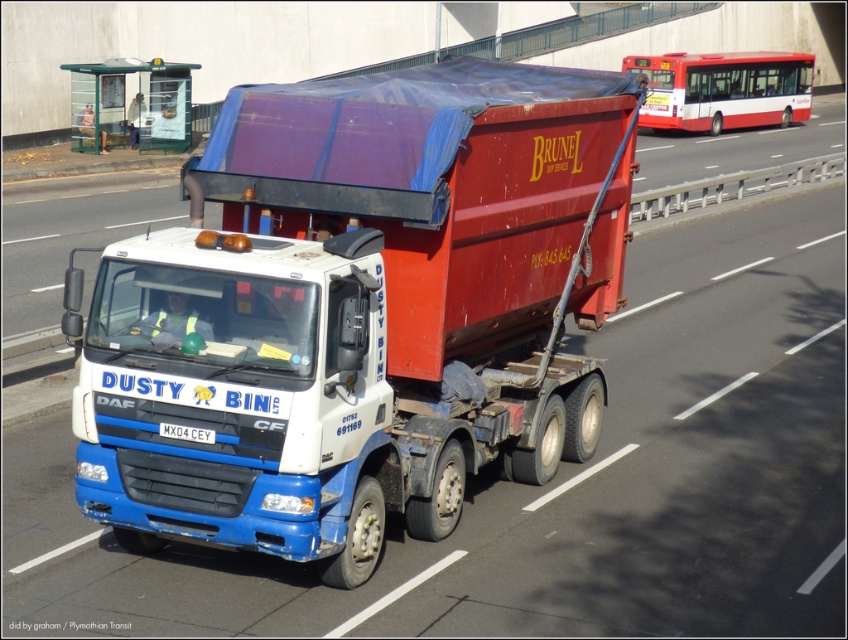
Question: In this image, where is matte white truck at center located relative to white plastic license plate at center?

Choices:
 (A) below
 (B) above

Answer: (B)

Question: Which point is farther to the camera?

Choices:
 (A) matte white truck at center
 (B) white plastic license plate at center

Answer: (B)

Question: Which of the following is the closest to the observer?

Choices:
 (A) (112, 394)
 (B) (205, 435)

Answer: (B)

Question: Is matte white truck at center above white plastic license plate at center?

Choices:
 (A) yes
 (B) no

Answer: (A)

Question: Which point appears farthest from the camera in this image?

Choices:
 (A) (159, 243)
 (B) (171, 435)

Answer: (A)

Question: Does matte white truck at center have a lesser width compared to white plastic license plate at center?

Choices:
 (A) yes
 (B) no

Answer: (B)